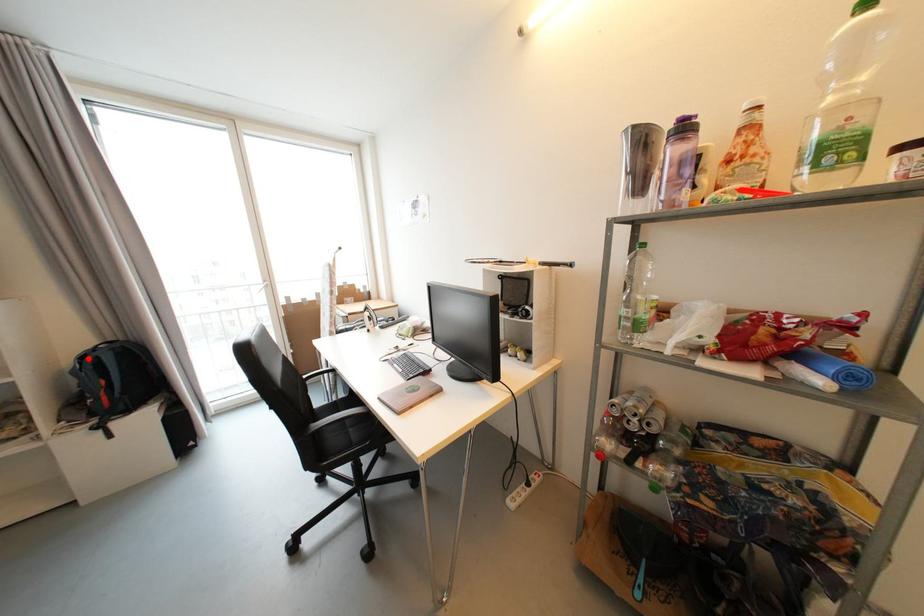
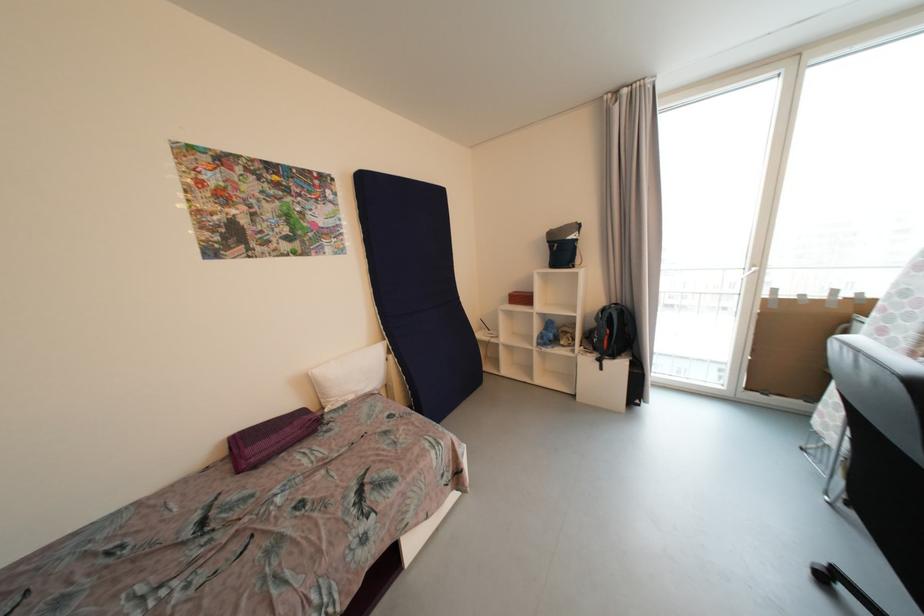
Question: I am providing you with two images of the same scene from different viewpoints. A red point is marked on the first image. Can you still see the location of the red point in image 2?

Choices:
 (A) Yes
 (B) No

Answer: (A)